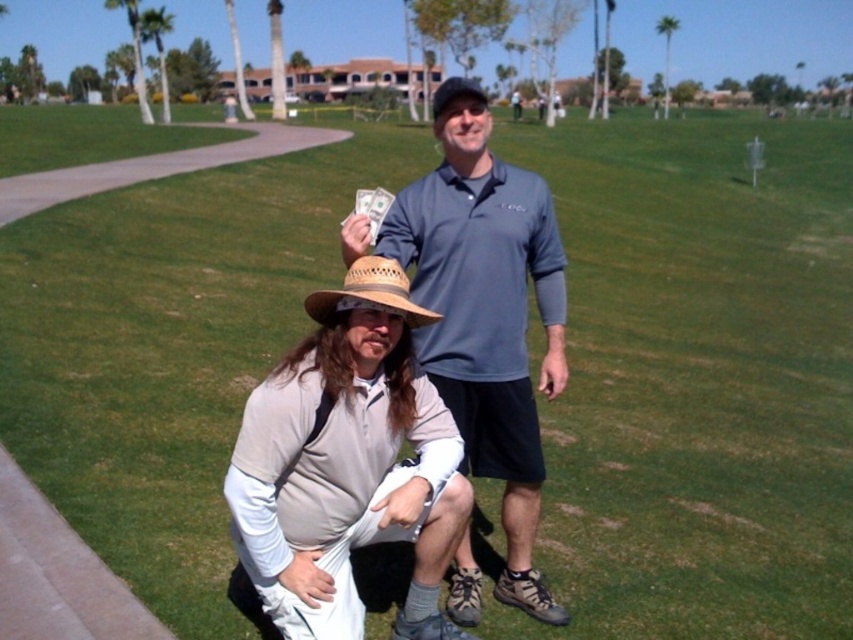
You are a photographer trying to capture a wide shot of the scene. You want to ensure both the straw woven hat at center and the green leafy palm tree at upper left are clearly visible. Given their sizes, which object might appear smaller in the final photo?

The straw woven hat at center appears smaller in the final photo because its width is less than the green leafy palm tree at upper left.

You are a photographer planning to take a photo of the two people in the scene. You want to ensure that both the green leafy palm tree at upper left and the black fabric hat at upper center are visible in the frame. Based on their positions, which object is closer to the top edge of the photo?

The green leafy palm tree at upper left is located above the black fabric hat at upper center, so it is closer to the top edge of the photo.

You are a photographer trying to capture a photo of the matte blue shirt at center and the green leafy palm tree at upper center. If you want both subjects to appear in the frame, which one should you focus on to ensure the other fits into the shot?

Since the matte blue shirt at center is narrower than the green leafy palm tree at upper center, you should focus on the green leafy palm tree at upper center to ensure the narrower matte blue shirt at center fits into the frame.